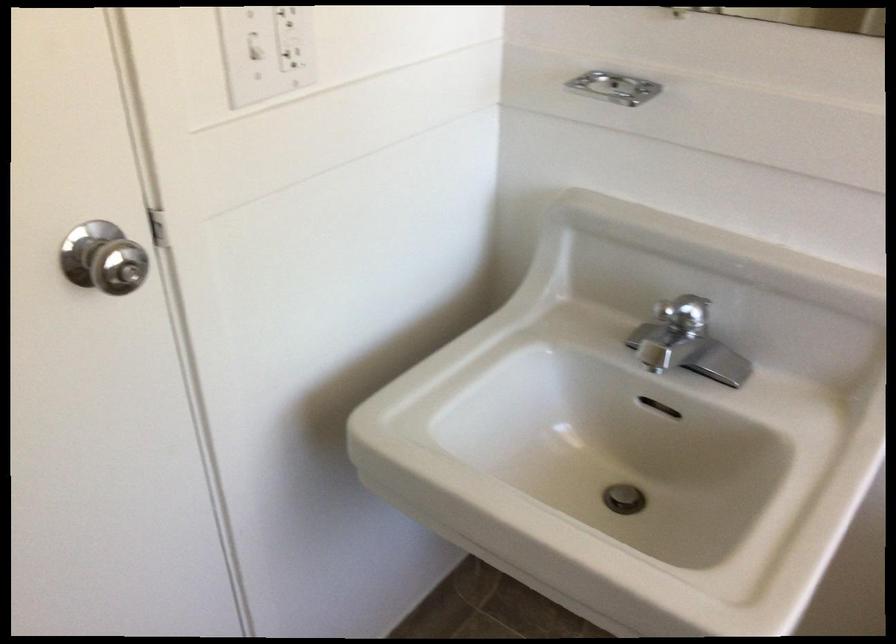
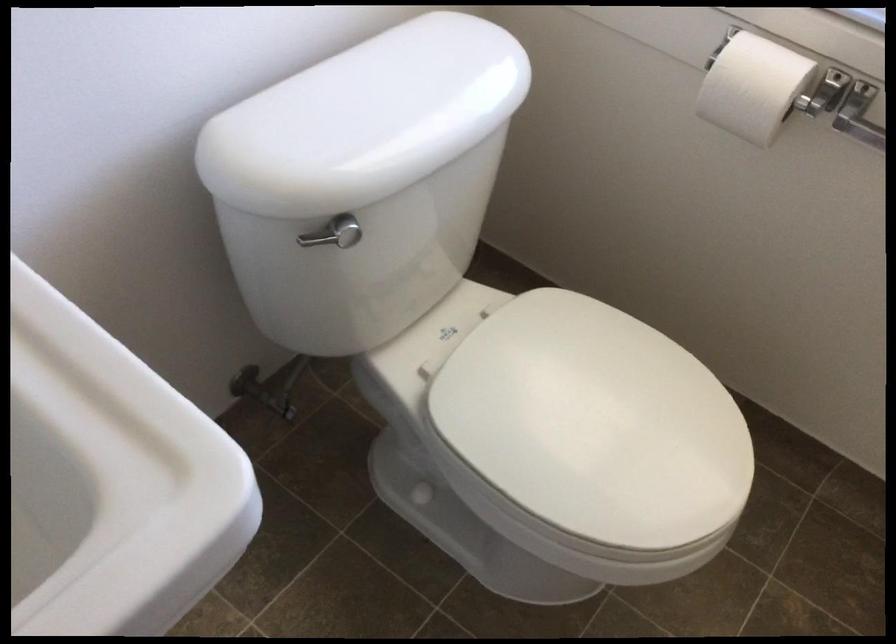
Based on the continuous images, in which direction is the camera rotating?

The rotation direction of the camera is right-down.